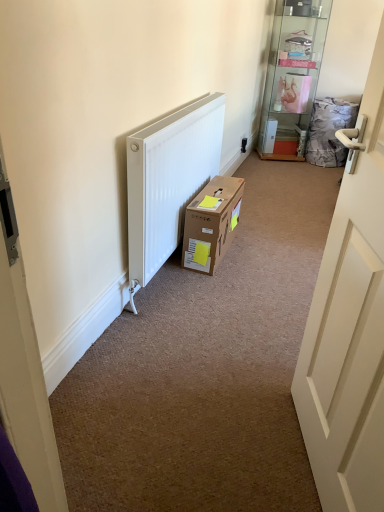
Question: From the image's perspective, is white matte door at right located above or below brown cardboard box at center?

Choices:
 (A) above
 (B) below

Answer: (B)

Question: Is white matte door at right in front of or behind brown cardboard box at center in the image?

Choices:
 (A) behind
 (B) front

Answer: (B)

Question: Considering the real-world distances, which object is closest to the clear glass shelf at upper right?

Choices:
 (A) black plastic electric outlet at upper right
 (B) white matte door at right
 (C) brown cardboard box at center

Answer: (A)

Question: Estimate the real-world distances between objects in this image. Which object is farther from the brown cardboard box at center?

Choices:
 (A) clear glass shelf at upper right
 (B) black plastic electric outlet at upper right
 (C) white matte door at right

Answer: (A)